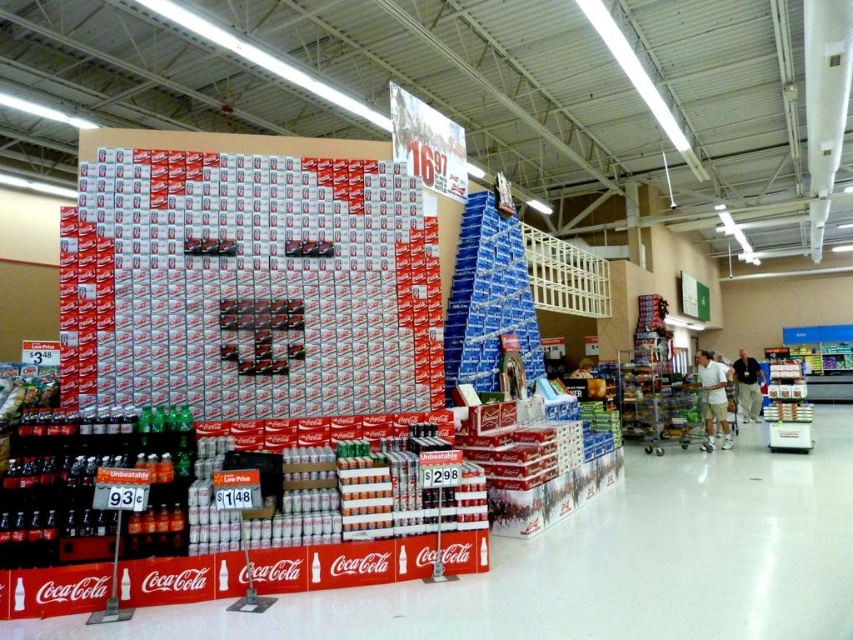
Question: Estimate the real-world distances between objects in this image. Which object is farther from the tan fabric pants at lower right?

Choices:
 (A) metallic silver shopping cart at center-right
 (B) white cotton t-shirt at center

Answer: (A)

Question: Does white cotton t-shirt at center appear on the right side of tan fabric pants at lower right?

Choices:
 (A) no
 (B) yes

Answer: (A)

Question: Which of the following is the closest to the observer?

Choices:
 (A) tan fabric pants at lower right
 (B) white cotton t-shirt at center

Answer: (B)

Question: Can you confirm if metallic silver shopping cart at center-right is positioned to the right of white cotton t-shirt at center?

Choices:
 (A) yes
 (B) no

Answer: (B)

Question: Does white cotton t-shirt at center appear under tan fabric pants at lower right?

Choices:
 (A) no
 (B) yes

Answer: (B)

Question: Which object is farther from the camera taking this photo?

Choices:
 (A) metallic silver shopping cart at center-right
 (B) white cotton t-shirt at center
 (C) tan fabric pants at lower right

Answer: (C)